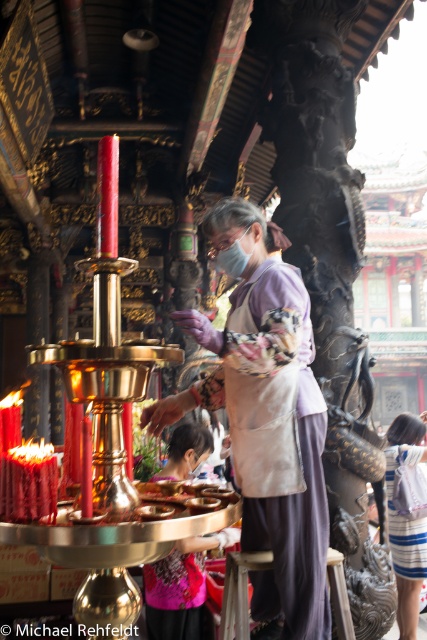
You are standing in the temple and want to place a new candle on the censer stand. The censer stand has a circular base with a diameter of 0.5 meters. Your hand is currently at position point (266, 420). Can you reach the censer stand from your current position without moving your hand?

The purple fabric apron at center is represented by point (266, 420). Since the censer stand has a diameter of 0.5 meters, and your hand is at point (266, 420), you need to check if the distance between your hand and the censer stand is within reach. However, without knowing the exact distance between the hand and the stand, it is impossible to determine reachability. Please provide more information about the spatial relationship between the hand and the censer stand.